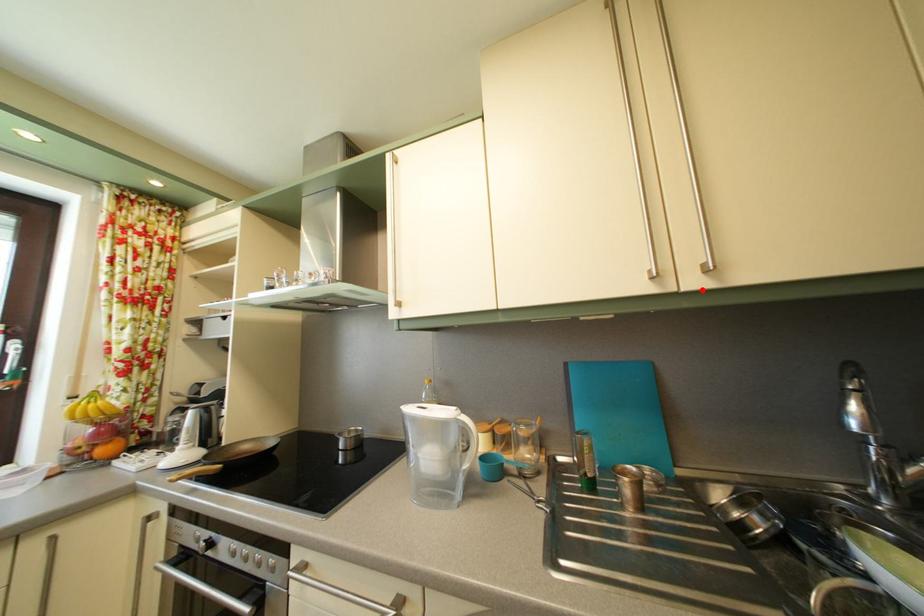
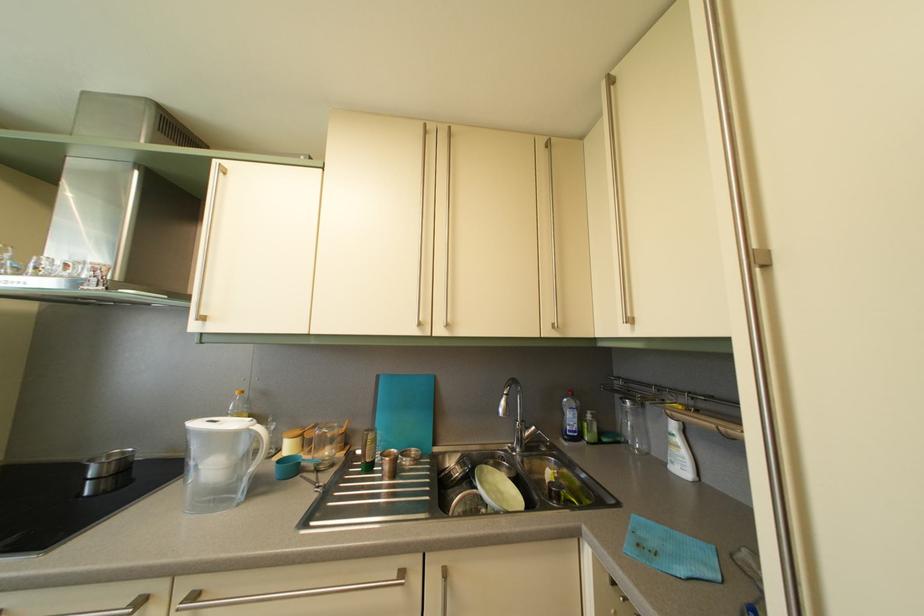
Find the pixel in the second image that matches the highlighted location in the first image.

(447, 339)